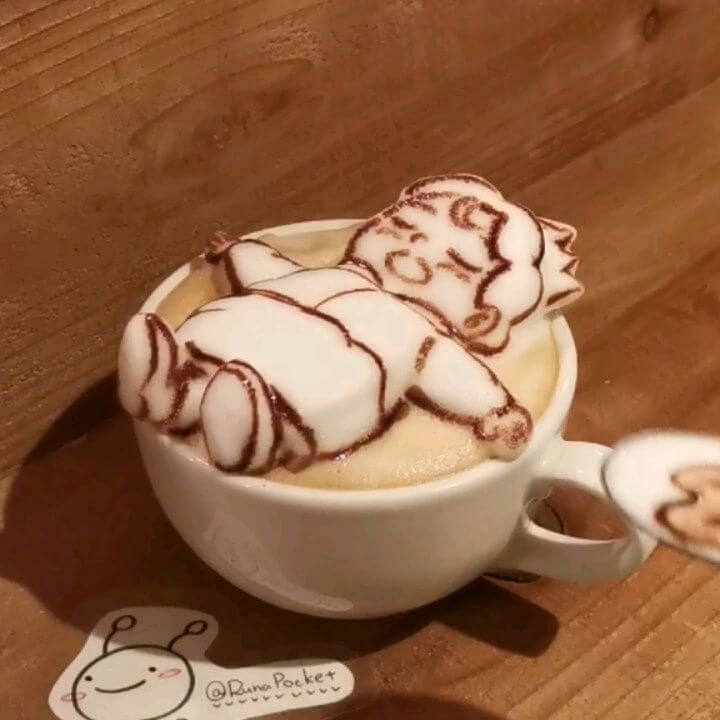
The image size is (720, 720). What are the coordinates of `foam` in the screenshot? It's located at (427, 454).